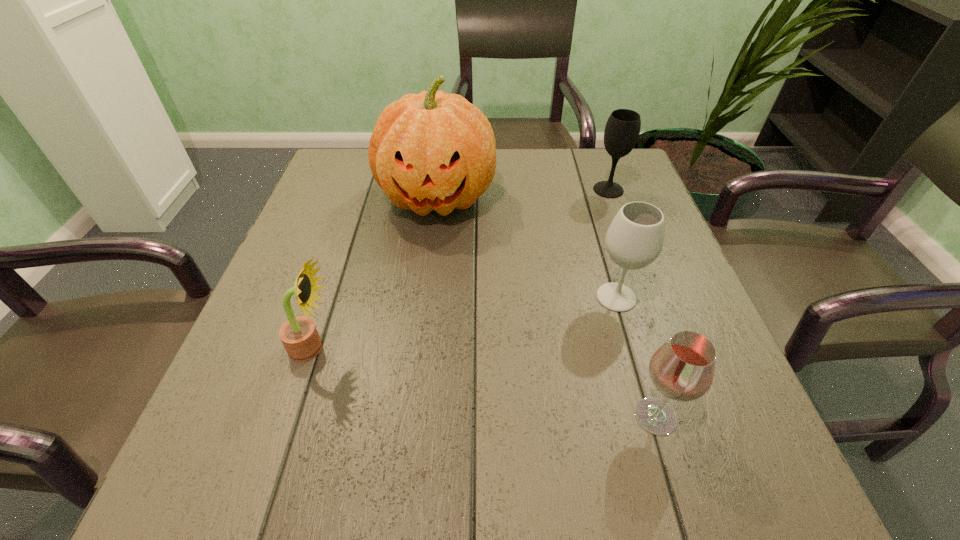
Choose which wineglass is the second nearest neighbor to the second nearest object. Please provide its 2D coordinates. Your answer should be formatted as a tuple, i.e. [(x, y)], where the tuple contains the x and y coordinates of a point satisfying the conditions above.

[(682, 369)]

Select which wineglass appears as the closest to the second farthest wineglass. Please provide its 2D coordinates. Your answer should be formatted as a tuple, i.e. [(x, y)], where the tuple contains the x and y coordinates of a point satisfying the conditions above.

[(682, 369)]

The width and height of the screenshot is (960, 540). What are the coordinates of `blank area in the image that satisfies the following two spatial constraints: 1. on the front side of the farthest wineglass; 2. on the face of the sunflower` in the screenshot? It's located at (665, 348).

In order to click on free location that satisfies the following two spatial constraints: 1. on the carved face of the nearest wineglass; 2. on the left side of the tallest object in this screenshot , I will do `click(412, 416)`.

Where is `free location that satisfies the following two spatial constraints: 1. on the back side of the farthest wineglass; 2. on the left side of the nearest wineglass`? free location that satisfies the following two spatial constraints: 1. on the back side of the farthest wineglass; 2. on the left side of the nearest wineglass is located at coordinates (588, 190).

I want to click on vacant region that satisfies the following two spatial constraints: 1. on the face of the sunflower; 2. on the right side of the nearest object, so pos(291,416).